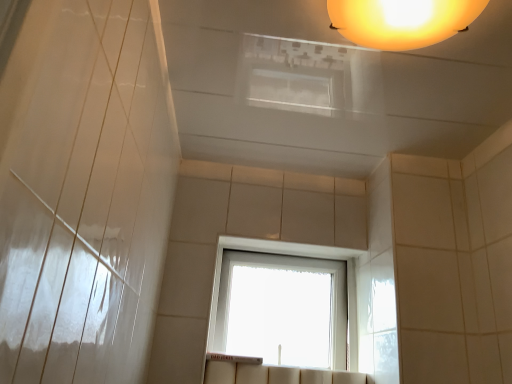
Question: Does matte orange globe at upper center have a smaller size compared to transparent glass window at center?

Choices:
 (A) yes
 (B) no

Answer: (A)

Question: Is matte orange globe at upper center surrounding transparent glass window at center?

Choices:
 (A) yes
 (B) no

Answer: (B)

Question: From a real-world perspective, does matte orange globe at upper center stand above transparent glass window at center?

Choices:
 (A) no
 (B) yes

Answer: (B)

Question: Is matte orange globe at upper center positioned in front of transparent glass window at center?

Choices:
 (A) no
 (B) yes

Answer: (B)

Question: From the image's perspective, does matte orange globe at upper center appear lower than transparent glass window at center?

Choices:
 (A) no
 (B) yes

Answer: (A)

Question: Does matte orange globe at upper center appear on the left side of transparent glass window at center?

Choices:
 (A) no
 (B) yes

Answer: (A)

Question: Can you confirm if transparent glass window at center is thinner than matte orange globe at upper center?

Choices:
 (A) yes
 (B) no

Answer: (A)

Question: Does transparent glass window at center have a lesser height compared to matte orange globe at upper center?

Choices:
 (A) yes
 (B) no

Answer: (B)

Question: From a real-world perspective, is transparent glass window at center positioned under matte orange globe at upper center based on gravity?

Choices:
 (A) no
 (B) yes

Answer: (B)

Question: Would you say transparent glass window at center is a long distance from matte orange globe at upper center?

Choices:
 (A) no
 (B) yes

Answer: (A)

Question: Is transparent glass window at center oriented towards matte orange globe at upper center?

Choices:
 (A) yes
 (B) no

Answer: (A)

Question: From the image's perspective, is transparent glass window at center on top of matte orange globe at upper center?

Choices:
 (A) no
 (B) yes

Answer: (A)

Question: Considering the relative positions of matte orange globe at upper center and transparent glass window at center in the image provided, is matte orange globe at upper center to the left or to the right of transparent glass window at center?

Choices:
 (A) left
 (B) right

Answer: (B)